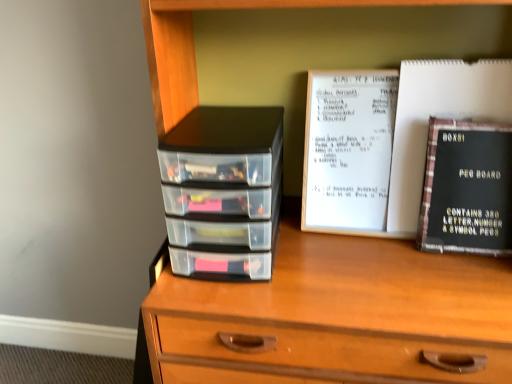
Describe the element at coordinates (467, 188) in the screenshot. I see `black matte peg board at right` at that location.

What do you see at coordinates (440, 117) in the screenshot? I see `black matte peg board at right` at bounding box center [440, 117].

Where is `black matte peg board at right`? This screenshot has height=384, width=512. black matte peg board at right is located at coordinates click(440, 117).

Find the location of a particular element. The image size is (512, 384). black matte peg board at right is located at coordinates (467, 188).

Where is `stack that is above the black matte peg board at right (from a real-world perspective)`? This screenshot has width=512, height=384. stack that is above the black matte peg board at right (from a real-world perspective) is located at coordinates (223, 192).

From a real-world perspective, which object stands above the other?

transparent plastic drawers at left is physically above.

Looking at this image, is transparent plastic drawers at left next to black matte peg board at right and touching it?

transparent plastic drawers at left and black matte peg board at right are clearly separated.

Does transparent plastic drawers at left have a greater height compared to black matte peg board at right?

Correct, transparent plastic drawers at left is much taller as black matte peg board at right.

Between point (472, 108) and point (506, 192), which one is positioned in front?

The point (506, 192) is closer.

The height and width of the screenshot is (384, 512). In order to click on book behind the black matte peg board at right in this screenshot , I will do `click(467, 188)`.

Does black matte peg board at right come behind black matte peg board at right?

No, black matte peg board at right is closer to the viewer.

From a real-world perspective, relative to black matte peg board at right, is black matte peg board at right vertically above or below?

In terms of real-world spatial position, black matte peg board at right is above black matte peg board at right.

Considering the positions of points (140, 339) and (189, 201), is point (140, 339) closer to camera compared to point (189, 201)?

No, it is behind (189, 201).

Is wooden chest of drawers at center facing away from transparent plastic drawers at left?

Absolutely, wooden chest of drawers at center is directed away from transparent plastic drawers at left.

How different are the orientations of wooden chest of drawers at center and transparent plastic drawers at left in degrees?

1.64 degrees separate the facing orientations of wooden chest of drawers at center and transparent plastic drawers at left.

Does wooden chest of drawers at center come in front of transparent plastic drawers at left?

Yes.

Are transparent plastic drawers at left and black matte peg board at right beside each other?

They are not placed beside each other.

Based on the photo, can you confirm if transparent plastic drawers at left is positioned to the right of black matte peg board at right?

Incorrect, transparent plastic drawers at left is not on the right side of black matte peg board at right.

From the image's perspective, between transparent plastic drawers at left and black matte peg board at right, which one is located above?

black matte peg board at right appears higher in the image.

From the picture: Can black matte peg board at right be found inside transparent plastic drawers at left?

That's incorrect, black matte peg board at right is not inside transparent plastic drawers at left.

Is wooden chest of drawers at center positioned beyond the bounds of black matte peg board at right?

wooden chest of drawers at center lies outside black matte peg board at right's area.

From the image's perspective, would you say wooden chest of drawers at center is shown under black matte peg board at right?

Yes.

In the image, there is a black matte peg board at right. Where is `the chest of drawers below it (from the image's perspective)`? Image resolution: width=512 pixels, height=384 pixels. the chest of drawers below it (from the image's perspective) is located at coordinates click(x=194, y=45).

Based on the photo, is wooden chest of drawers at center facing away from black matte peg board at right?

That's right, wooden chest of drawers at center is facing away from black matte peg board at right.

Consider the image. Is black matte peg board at right behind transparent plastic drawers at left?

That is True.

Is black matte peg board at right placed right next to transparent plastic drawers at left?

No, black matte peg board at right is not beside transparent plastic drawers at left.

Between black matte peg board at right and transparent plastic drawers at left, which one appears on the right side from the viewer's perspective?

black matte peg board at right is more to the right.

Which of these two, black matte peg board at right or transparent plastic drawers at left, is bigger?

With larger size is transparent plastic drawers at left.

Which point is more distant from viewer, (261, 193) or (183, 85)?

Point (183, 85)

Would you say transparent plastic drawers at left is outside wooden chest of drawers at center?

No, most part of transparent plastic drawers at left lies within wooden chest of drawers at center.

Can you confirm if transparent plastic drawers at left is positioned to the right of wooden chest of drawers at center?

No, transparent plastic drawers at left is not to the right of wooden chest of drawers at center.

Looking at this image, between transparent plastic drawers at left and wooden chest of drawers at center, which one has larger size?

wooden chest of drawers at center.

Where is `book on the right of transparent plastic drawers at left`? The image size is (512, 384). book on the right of transparent plastic drawers at left is located at coordinates (467, 188).

You are a GUI agent. You are given a task and a screenshot of the screen. Output one action in this format:
    pyautogui.click(x=<x>, y=<y>)
    Task: Click on the book behind the black matte peg board at right
    
    Given the screenshot: What is the action you would take?
    pyautogui.click(x=467, y=188)

Considering their positions, is black matte peg board at right positioned further to wooden chest of drawers at center than black matte peg board at right?

Based on the image, black matte peg board at right appears to be further to wooden chest of drawers at center.

Looking at the image, which one is located closer to black matte peg board at right, wooden chest of drawers at center or transparent plastic drawers at left?

wooden chest of drawers at center lies closer to black matte peg board at right than the other object.

Looking at the image, which one is located further to black matte peg board at right, black matte peg board at right or wooden chest of drawers at center?

wooden chest of drawers at center lies further to black matte peg board at right than the other object.

From the image, which object appears to be nearer to black matte peg board at right, black matte peg board at right or transparent plastic drawers at left?

Based on the image, black matte peg board at right appears to be nearer to black matte peg board at right.

Estimate the real-world distances between objects in this image. Which object is closer to wooden chest of drawers at center, transparent plastic drawers at left or black matte peg board at right?

Among the two, transparent plastic drawers at left is located nearer to wooden chest of drawers at center.

Which object lies further to the anchor point black matte peg board at right, transparent plastic drawers at left or wooden chest of drawers at center?

transparent plastic drawers at left.

Consider the image. From the image, which object appears to be nearer to black matte peg board at right, wooden chest of drawers at center or black matte peg board at right?

black matte peg board at right.

Considering their positions, is wooden chest of drawers at center positioned further to transparent plastic drawers at left than black matte peg board at right?

Based on the image, black matte peg board at right appears to be further to transparent plastic drawers at left.

This screenshot has width=512, height=384. I want to click on chest of drawers between transparent plastic drawers at left and black matte peg board at right in the horizontal direction, so click(194, 45).

What are the coordinates of `chest of drawers between transparent plastic drawers at left and black matte peg board at right in the horizontal direction` in the screenshot? It's located at (194, 45).

Where is `paperback book between wooden chest of drawers at center and black matte peg board at right from front to back`? The height and width of the screenshot is (384, 512). paperback book between wooden chest of drawers at center and black matte peg board at right from front to back is located at coordinates (440, 117).

In order to click on paperback book between transparent plastic drawers at left and black matte peg board at right in the horizontal direction in this screenshot , I will do `click(440, 117)`.